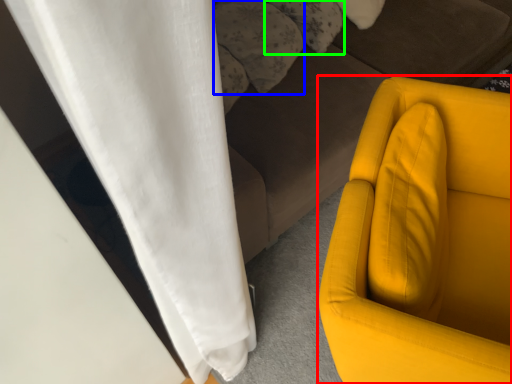
Question: Which is nearer to the furniture (highlighted by a red box)? pillow (highlighted by a blue box) or pillow (highlighted by a green box).

Choices:
 (A) pillow
 (B) pillow

Answer: (A)